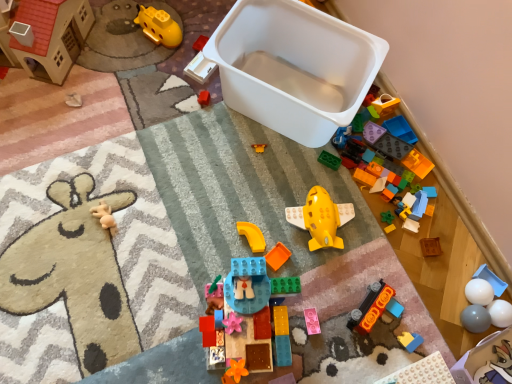
Locate an element on the screen. The height and width of the screenshot is (384, 512). empty space that is in between pink matte block at center, the tenth toy positioned from the right, and cardboard house at upper left, which is the sixteenth toy in right-to-left order is located at coordinates [x=137, y=152].